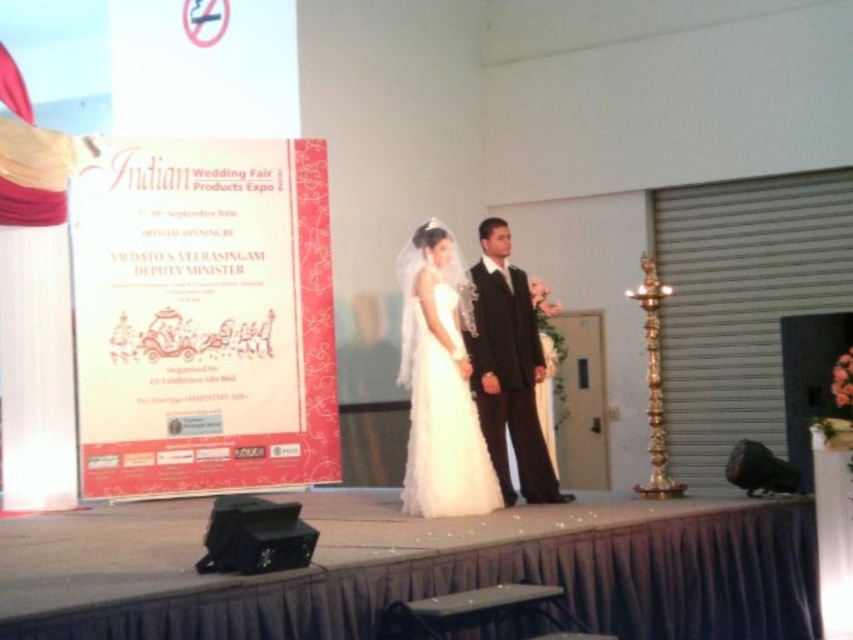
You are planning to seat guests in the front row of the Indian Wedding Fair Products Expo. The white satin dress at center and the black satin suit at center are both on stage. Which of the two occupies more space horizontally?

The black satin suit at center occupies more horizontal space since it has a greater width than the white satin dress at center.

You are attending the Indian Wedding Fair Products Expo and want to take a photo of the stage from where you are standing. The camera you have can focus on objects up to 5 meters away. Is the point at coordinates point (453, 492) within the camera focus range?

The distance between point (453, 492) and the camera is 6.42 meters, which exceeds the camera focus range of 5 meters. Therefore, the camera cannot focus on that point.

You are a photographer at the Indian Wedding Fair Products Expo. You need to position two lights for the stage setup. The first light should be placed at point A, which is at coordinates point (421, 342), and the second light at point B, coordinates point (541, 360). Based on their positions, which light is closer to the audience sitting in front of the stage?

Point (421, 342) is in front of point (541, 360), so the light at point (421, 342) is closer to the audience.